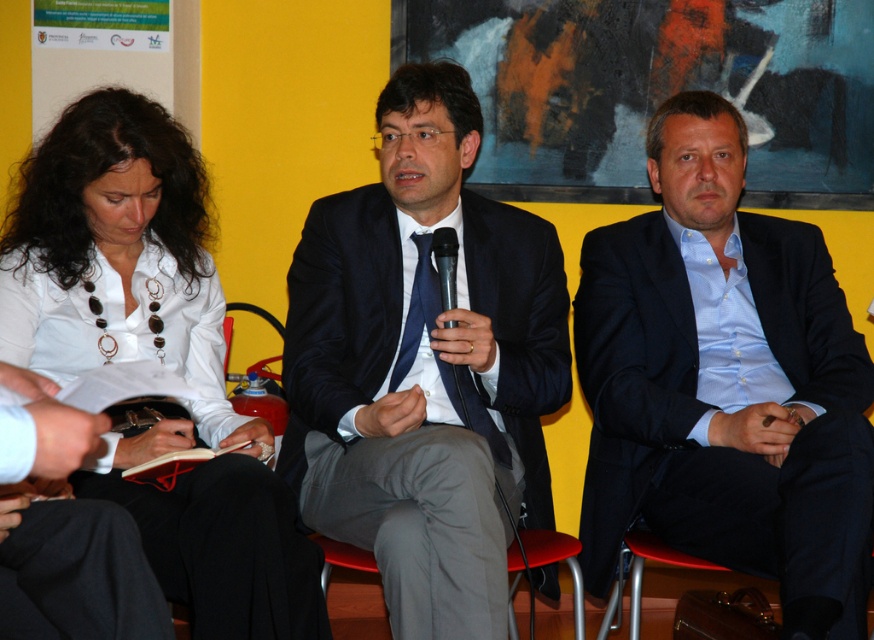
You are an event organizer and need to arrange seating for a panel discussion. You see the matte black suit at center and the white glossy shirt at upper left in the image. Which one is closer to the front of the stage?

The matte black suit at center is positioned over the white glossy shirt at upper left, meaning it is closer to the front of the stage.

You are standing in front of the image. Where is the matte black suit at center located in terms of coordinates?

The matte black suit at center is located at coordinates point (424,365).

You are organizing a panel discussion and need to arrange the speakers according to their seating order. The speakers are wearing a matte black suit at center and a blue satin suit at center. Based on the image, which speaker should be introduced first?

The speaker wearing the matte black suit at center should be introduced first because he is seated to the left of the blue satin suit at center, indicating he is on the left side of the arrangement.